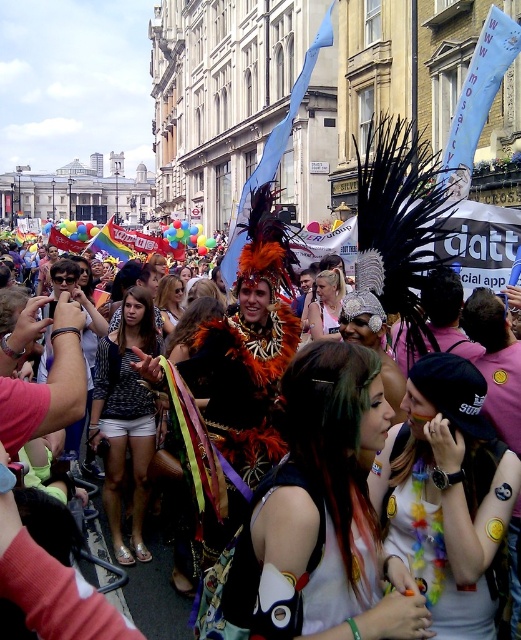
Does multicolored sequined top at center have a larger size compared to shiny metallic top at center?

Yes, multicolored sequined top at center is bigger than shiny metallic top at center.

Does multicolored sequined top at center appear on the left side of shiny metallic top at center?

In fact, multicolored sequined top at center is to the right of shiny metallic top at center.

Which is behind, point (457, 592) or point (137, 397)?

The point (137, 397) is behind.

This screenshot has width=521, height=640. Find the location of `multicolored sequined top at center`. multicolored sequined top at center is located at coordinates (431, 548).

Can you confirm if feathered headdress at center is shorter than shiny metallic top at center?

In fact, feathered headdress at center may be taller than shiny metallic top at center.

Does feathered headdress at center appear on the right side of shiny metallic top at center?

Yes, feathered headdress at center is to the right of shiny metallic top at center.

Who is more forward, (334, 244) or (120, 417)?

Point (120, 417)

Locate an element on the screen. The height and width of the screenshot is (640, 521). feathered headdress at center is located at coordinates (500, 390).

Can you confirm if feathered headdress at center is positioned to the right of multicolored sequined top at center?

Incorrect, feathered headdress at center is not on the right side of multicolored sequined top at center.

Which is in front, point (33, 326) or point (440, 582)?

Point (440, 582) is more forward.

The width and height of the screenshot is (521, 640). I want to click on feathered headdress at center, so pyautogui.click(x=500, y=390).